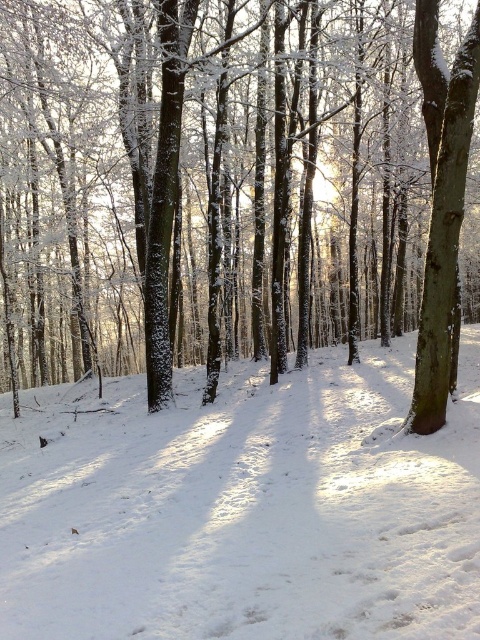
Question: Considering the relative positions of white powdery snow at center and smooth bark tree at right in the image provided, where is white powdery snow at center located with respect to smooth bark tree at right?

Choices:
 (A) above
 (B) below

Answer: (B)

Question: From the image, what is the correct spatial relationship of white powdery snow at center in relation to smooth bark tree at right?

Choices:
 (A) left
 (B) right

Answer: (A)

Question: Based on their relative distances, which object is farther from the white powdery snow at center?

Choices:
 (A) smooth bark tree at right
 (B) snow-covered tree at center

Answer: (B)

Question: Which object is the closest to the white powdery snow at center?

Choices:
 (A) snow-covered tree at center
 (B) smooth bark tree at right

Answer: (B)

Question: Based on their relative distances, which object is farther from the snow-covered tree at center?

Choices:
 (A) smooth bark tree at right
 (B) white powdery snow at center

Answer: (A)

Question: Does snow-covered tree at center appear under white powdery snow at center?

Choices:
 (A) yes
 (B) no

Answer: (B)